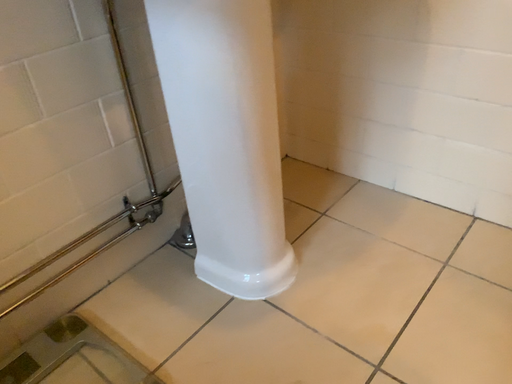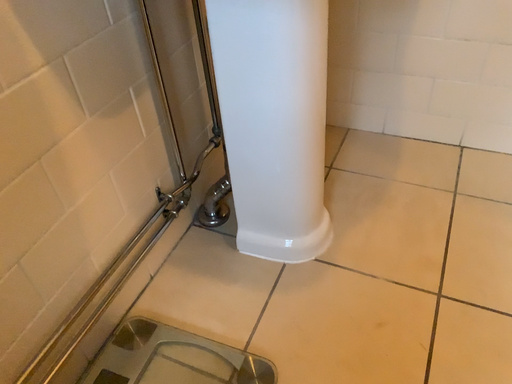
Question: Which way did the camera rotate in the video?

Choices:
 (A) rotated left
 (B) rotated right

Answer: (B)